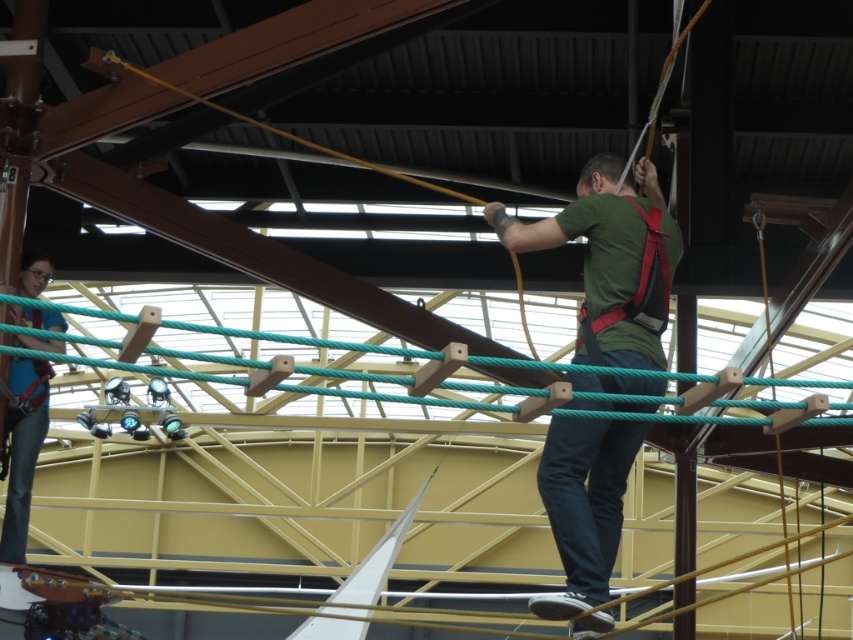
Measure the distance from green matte shirt at center to denim pants at lower left.

They are 11.48 feet apart.

Is green matte shirt at center thinner than denim pants at lower left?

No.

Between point (627, 307) and point (20, 474), which one is positioned behind?

Positioned behind is point (20, 474).

The height and width of the screenshot is (640, 853). Identify the location of green matte shirt at center. (611, 260).